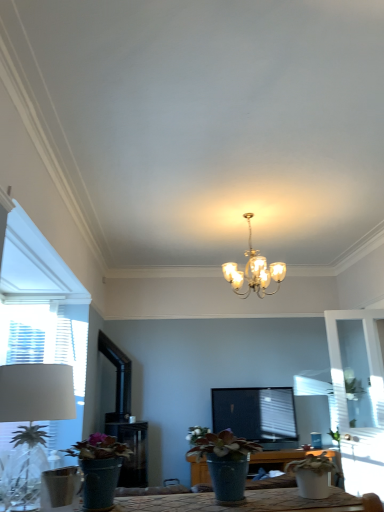
Question: From the image's perspective, is white fabric lampshade at left located beneath white matte flower at center?

Choices:
 (A) yes
 (B) no

Answer: (B)

Question: Is white fabric lampshade at left looking in the opposite direction of white matte flower at center?

Choices:
 (A) no
 (B) yes

Answer: (B)

Question: Could you tell me if white fabric lampshade at left is facing white matte flower at center?

Choices:
 (A) no
 (B) yes

Answer: (A)

Question: Can you confirm if white fabric lampshade at left is bigger than white matte flower at center?

Choices:
 (A) no
 (B) yes

Answer: (B)

Question: Considering the relative sizes of white fabric lampshade at left and white matte flower at center in the image provided, is white fabric lampshade at left taller than white matte flower at center?

Choices:
 (A) yes
 (B) no

Answer: (A)

Question: From the image's perspective, is white matte pot at lower right, which is the 3th houseplant in left-to-right order, above or below matte blue pot at center, which is counted as the second houseplant, starting from the right?

Choices:
 (A) above
 (B) below

Answer: (B)

Question: From a real-world perspective, relative to matte blue pot at center, the 2th houseplant positioned from the left, is white matte pot at lower right, which is the 3th houseplant in left-to-right order, vertically above or below?

Choices:
 (A) above
 (B) below

Answer: (B)

Question: Is point (304, 466) positioned closer to the camera than point (215, 480)?

Choices:
 (A) farther
 (B) closer

Answer: (A)

Question: Do you think white matte pot at lower right, which is the 1th houseplant in right-to-left order, is within matte blue pot at center, the 2th houseplant positioned from the left, or outside of it?

Choices:
 (A) inside
 (B) outside

Answer: (B)

Question: Considering their positions, is white matte flower at center located in front of or behind matte green pot at lower left, which is the first houseplant from left to right?

Choices:
 (A) front
 (B) behind

Answer: (B)

Question: From a real-world perspective, is white matte flower at center above or below matte green pot at lower left, placed as the third houseplant when sorted from right to left?

Choices:
 (A) below
 (B) above

Answer: (A)

Question: Is white matte flower at center to the left or to the right of matte green pot at lower left, which is the first houseplant from left to right, in the image?

Choices:
 (A) right
 (B) left

Answer: (A)

Question: Considering the positions of white matte flower at center and matte green pot at lower left, placed as the third houseplant when sorted from right to left, in the image, is white matte flower at center taller or shorter than matte green pot at lower left, placed as the third houseplant when sorted from right to left,?

Choices:
 (A) tall
 (B) short

Answer: (A)

Question: Considering the positions of white matte pot at lower right, which is the 3th houseplant in left-to-right order, and white fabric lampshade at left in the image, is white matte pot at lower right, which is the 3th houseplant in left-to-right order, taller or shorter than white fabric lampshade at left?

Choices:
 (A) short
 (B) tall

Answer: (A)

Question: In the image, is white matte pot at lower right, which is the 1th houseplant in right-to-left order, positioned in front of or behind white fabric lampshade at left?

Choices:
 (A) behind
 (B) front

Answer: (A)